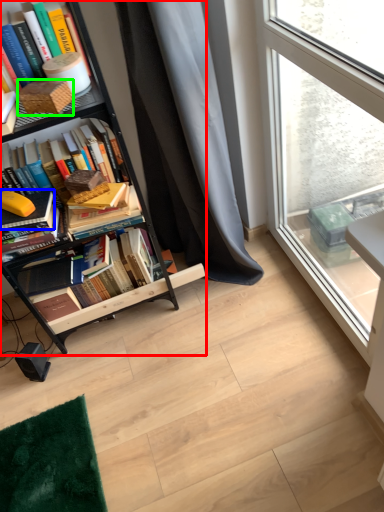
Question: Which is farther away from bookcase (highlighted by a red box)? book (highlighted by a blue box) or paperback book (highlighted by a green box)?

Choices:
 (A) book
 (B) paperback book

Answer: (B)